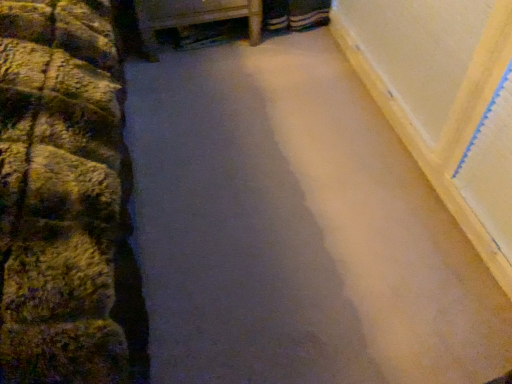
At what (x,y) coordinates should I click in order to perform the action: click on vacant space in front of wooden bed frame at upper center. Please return your answer as a coordinate pair (x, y). This screenshot has width=512, height=384. Looking at the image, I should click on (207, 86).